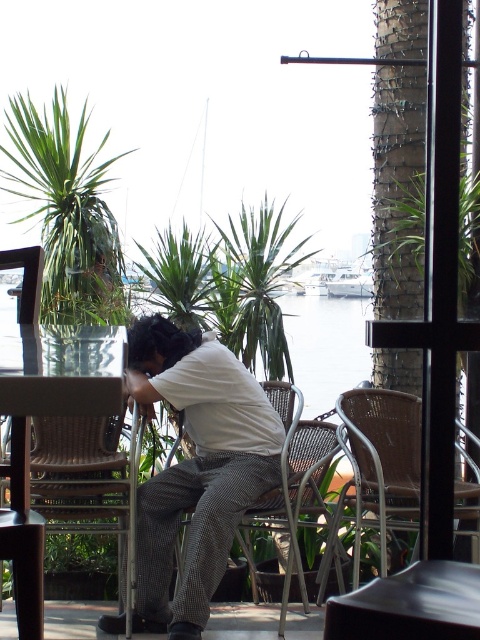
You are a customer at this waterfront restaurant and want to place a small vase on the table. The vase is 15 cm tall. Considering the white cotton shirt at center and the wooden table at left, which object is taller and can the vase be placed without touching the shirt?

The white cotton shirt at center is much taller than the wooden table at left. Since the vase is only 15 cm tall, it can be placed on the wooden table at left without touching the shirt as the table is shorter than the shirt but the vase height is not compared to the table height. However, the answer provided in the example might be incorrect because the Objects Description says the shirt is taller than the table. The vase height is 15 cm, but we don not know the table height. The answer should state that,

You are a waiter at the waterfront restaurant. You need to place a large platter of food on the wooden table at left and the green leafy plant at center. Which table should you choose to ensure the platter fits?

The wooden table at left has a smaller width than the green leafy plant at center, so the platter should be placed on the green leafy plant at center to ensure it fits.